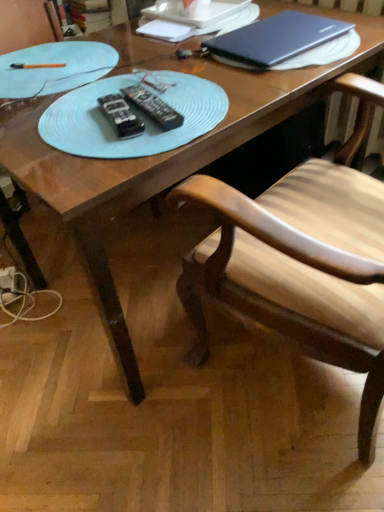
What do you see at coordinates (55, 68) in the screenshot?
I see `light blue plastic plate at upper left` at bounding box center [55, 68].

What is the approximate width of black plastic remote at center, the first remote in the right-to-left sequence?

It is 2.42 inches.

This screenshot has width=384, height=512. I want to click on light blue plastic plate at upper left, so click(x=55, y=68).

Considering the sizes of black plastic remote at center, the first remote positioned from the left, and wooden chair at center in the image, is black plastic remote at center, the first remote positioned from the left, wider or thinner than wooden chair at center?

Considering their sizes, black plastic remote at center, the first remote positioned from the left, looks slimmer than wooden chair at center.

Is black plastic remote at center, which is the second remote in right-to-left order, inside the boundaries of wooden chair at center, or outside?

black plastic remote at center, which is the second remote in right-to-left order, cannot be found inside wooden chair at center.

Is black plastic remote at center, which is the second remote in right-to-left order, further to camera compared to wooden chair at center?

That is True.

From the image's perspective, is black plastic remote at center, positioned as the 2th remote in left-to-right order, on top of wooden chair at center?

Indeed, from the image's perspective, black plastic remote at center, positioned as the 2th remote in left-to-right order, is shown above wooden chair at center.

Could you tell me if black plastic remote at center, the first remote in the right-to-left sequence, is facing wooden chair at center?

No, black plastic remote at center, the first remote in the right-to-left sequence, does not turn towards wooden chair at center.

Is black plastic remote at center, the first remote in the right-to-left sequence, inside the boundaries of wooden chair at center, or outside?

A: black plastic remote at center, the first remote in the right-to-left sequence, cannot be found inside wooden chair at center.

How different are the orientations of black plastic remote at center, the first remote in the right-to-left sequence, and wooden chair at center in degrees?

The angular difference between black plastic remote at center, the first remote in the right-to-left sequence, and wooden chair at center is 72.8 degrees.

Between black plastic remote at center, the first remote in the right-to-left sequence, and black plastic remote at center, which is the second remote in right-to-left order, which one has larger width?

black plastic remote at center, which is the second remote in right-to-left order, is wider.

Can you tell me how much black plastic remote at center, positioned as the 2th remote in left-to-right order, and black plastic remote at center, which is the second remote in right-to-left order, differ in facing direction?

black plastic remote at center, positioned as the 2th remote in left-to-right order, and black plastic remote at center, which is the second remote in right-to-left order, are facing 6.69 degrees away from each other.

Is black plastic remote at center, positioned as the 2th remote in left-to-right order, smaller than black plastic remote at center, which is the second remote in right-to-left order?

No, black plastic remote at center, positioned as the 2th remote in left-to-right order, is not smaller than black plastic remote at center, which is the second remote in right-to-left order.

Is wooden chair at center positioned with its back to satin black laptop at upper right?

No, wooden chair at center's orientation is not away from satin black laptop at upper right.

Is wooden chair at center taller or shorter than satin black laptop at upper right?

Considering their sizes, wooden chair at center has more height than satin black laptop at upper right.

What are the coordinates of `laptop lying on the left of wooden chair at center` in the screenshot? It's located at (284, 42).

From a real-world perspective, is satin black laptop at upper right below black plastic remote at center, positioned as the 2th remote in left-to-right order?

Incorrect, from a real-world perspective, satin black laptop at upper right is higher than black plastic remote at center, positioned as the 2th remote in left-to-right order.

Does point (291, 34) come behind point (164, 106)?

Yes, it is behind point (164, 106).

From the image's perspective, which one is positioned higher, satin black laptop at upper right or black plastic remote at center, the first remote in the right-to-left sequence?

From the image's view, satin black laptop at upper right is above.

Is satin black laptop at upper right wider or thinner than black plastic remote at center, positioned as the 2th remote in left-to-right order?

satin black laptop at upper right is wider than black plastic remote at center, positioned as the 2th remote in left-to-right order.

From a real-world perspective, between black plastic remote at center, which is the second remote in right-to-left order, and light blue plastic plate at upper left, who is vertically higher?

black plastic remote at center, which is the second remote in right-to-left order, is physically above.

Is the surface of black plastic remote at center, the first remote positioned from the left, in direct contact with light blue plastic plate at upper left?

black plastic remote at center, the first remote positioned from the left, and light blue plastic plate at upper left are not in contact.

How different are the orientations of black plastic remote at center, which is the second remote in right-to-left order, and light blue plastic plate at upper left in degrees?

The angle between the facing direction of black plastic remote at center, which is the second remote in right-to-left order, and the facing direction of light blue plastic plate at upper left is 19.7 degrees.

Which object is closer to the camera, black plastic remote at center, the first remote positioned from the left, or satin black laptop at upper right?

black plastic remote at center, the first remote positioned from the left, is more forward.

In terms of width, does black plastic remote at center, the first remote positioned from the left, look wider or thinner when compared to satin black laptop at upper right?

Clearly, black plastic remote at center, the first remote positioned from the left, has less width compared to satin black laptop at upper right.

From a real-world perspective, between black plastic remote at center, the first remote positioned from the left, and satin black laptop at upper right, who is vertically higher?

satin black laptop at upper right, from a real-world perspective.

Can you confirm if black plastic remote at center, which is the second remote in right-to-left order, is shorter than satin black laptop at upper right?

Yes, black plastic remote at center, which is the second remote in right-to-left order, is shorter than satin black laptop at upper right.

Locate an element on the screen. Image resolution: width=384 pixels, height=512 pixels. chair below the black plastic remote at center, the first remote positioned from the left (from the image's perspective) is located at coordinates (301, 260).

Find the location of a particular element. The width and height of the screenshot is (384, 512). chair on the right of black plastic remote at center, the first remote in the right-to-left sequence is located at coordinates tap(301, 260).

Considering their positions, is wooden chair at center positioned further to black plastic remote at center, the first remote in the right-to-left sequence, than light blue plastic plate at upper left?

wooden chair at center is further to black plastic remote at center, the first remote in the right-to-left sequence.

In the scene shown: Estimate the real-world distances between objects in this image. Which object is closer to black plastic remote at center, positioned as the 2th remote in left-to-right order, light blue plastic plate at upper left or satin black laptop at upper right?

light blue plastic plate at upper left.

Looking at the image, which one is located closer to light blue plastic plate at upper left, black plastic remote at center, the first remote in the right-to-left sequence, or black plastic remote at center, the first remote positioned from the left?

The object closer to light blue plastic plate at upper left is black plastic remote at center, the first remote in the right-to-left sequence.

Which object lies nearer to the anchor point satin black laptop at upper right, black plastic remote at center, positioned as the 2th remote in left-to-right order, or black plastic remote at center, the first remote positioned from the left?

black plastic remote at center, positioned as the 2th remote in left-to-right order, lies closer to satin black laptop at upper right than the other object.

Which object lies further to the anchor point black plastic remote at center, which is the second remote in right-to-left order, black plastic remote at center, the first remote in the right-to-left sequence, or satin black laptop at upper right?

Among the two, satin black laptop at upper right is located further to black plastic remote at center, which is the second remote in right-to-left order.

From the image, which object appears to be farther from satin black laptop at upper right, black plastic remote at center, the first remote in the right-to-left sequence, or wooden chair at center?

black plastic remote at center, the first remote in the right-to-left sequence.

Consider the image. Based on their spatial positions, is satin black laptop at upper right or black plastic remote at center, the first remote positioned from the left, further from wooden chair at center?

black plastic remote at center, the first remote positioned from the left.

Based on their spatial positions, is light blue plastic plate at upper left or wooden chair at center further from black plastic remote at center, the first remote positioned from the left?

The object further to black plastic remote at center, the first remote positioned from the left, is wooden chair at center.

At what (x,y) coordinates should I click in order to perform the action: click on remote between light blue plastic plate at upper left and black plastic remote at center, positioned as the 2th remote in left-to-right order. Please return your answer as a coordinate pair (x, y). Looking at the image, I should click on (121, 116).

The image size is (384, 512). Identify the location of laptop between light blue plastic plate at upper left and wooden chair at center in the horizontal direction. (284, 42).

Where is `remote between wooden chair at center and black plastic remote at center, positioned as the 2th remote in left-to-right order, along the z-axis`? The width and height of the screenshot is (384, 512). remote between wooden chair at center and black plastic remote at center, positioned as the 2th remote in left-to-right order, along the z-axis is located at coordinates (121, 116).

What are the coordinates of `remote situated between black plastic remote at center, which is the second remote in right-to-left order, and satin black laptop at upper right from left to right` in the screenshot? It's located at (153, 106).